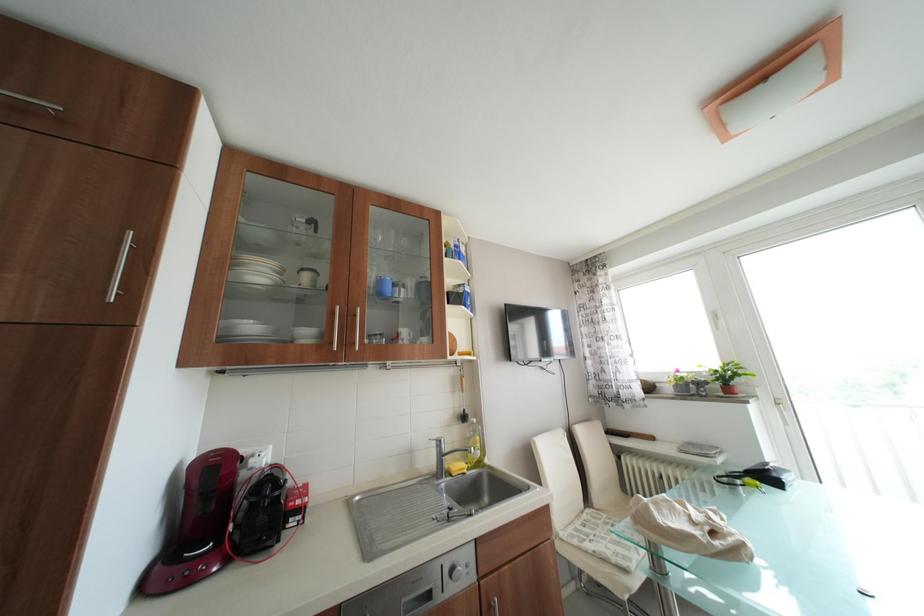
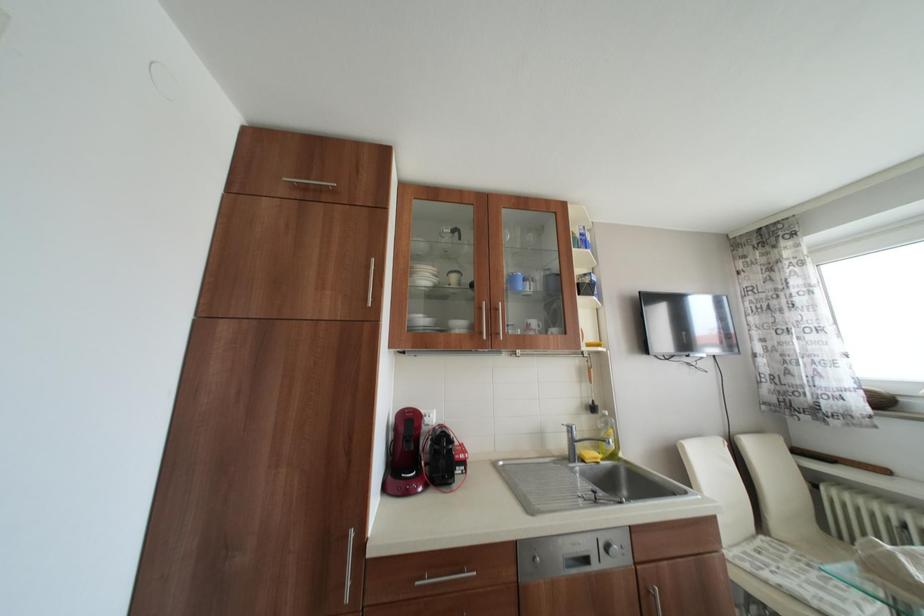
Question: How did the camera likely rotate?

Choices:
 (A) Left
 (B) Right
 (C) Up
 (D) Down

Answer: (A)